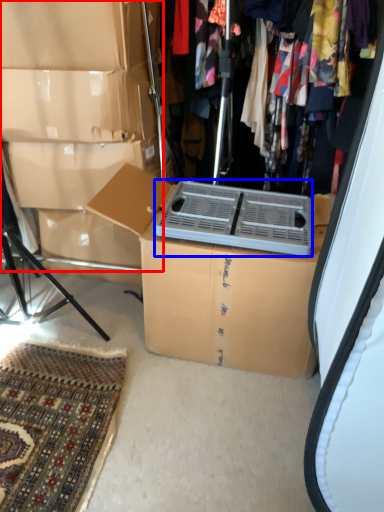
Question: Which point is further to the camera, storage box (highlighted by a red box) or appliance (highlighted by a blue box)?

Choices:
 (A) storage box
 (B) appliance

Answer: (A)